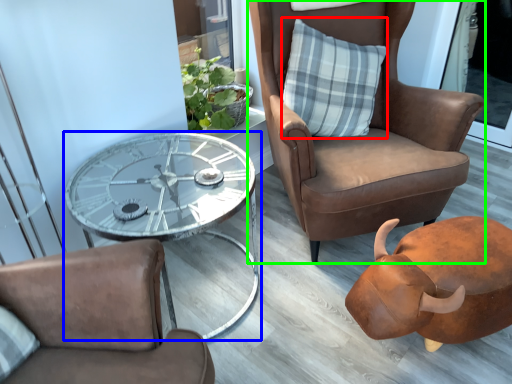
Question: Which object is the farthest from pillow (highlighted by a red box)? Choose among these: coffee table (highlighted by a blue box) or chair (highlighted by a green box).

Choices:
 (A) coffee table
 (B) chair

Answer: (A)